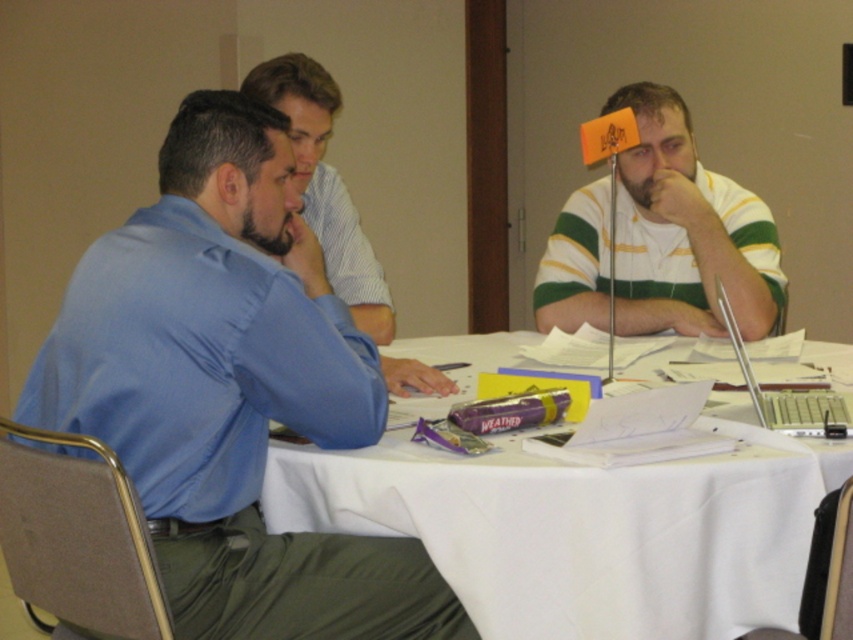
In the scene shown: You are standing at the camera position and want to reach the point marked at coordinates (196, 344). Is this point within your immediate reach without moving your feet?

The point marked at coordinates (196, 344) is 1.67 meters away from the camera, so it is out of immediate reach without moving your feet.

You are a person sitting at the white cloth table at center. You want to place your silver metallic laptop at right onto the table. Is the laptop currently on the table?

The white cloth table at center is positioned under the silver metallic laptop at right, meaning the laptop is already on the table.